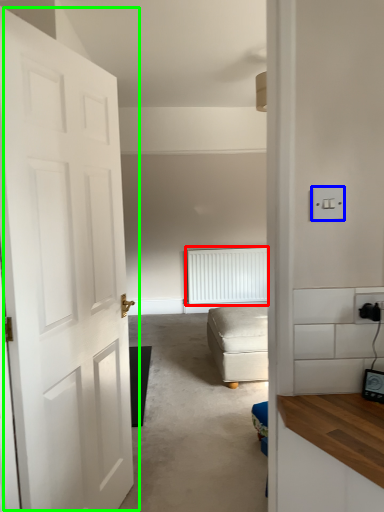
Question: Which object is positioned closest to radiator (highlighted by a red box)? Select from light switch (highlighted by a blue box) and door (highlighted by a green box).

Choices:
 (A) light switch
 (B) door

Answer: (B)